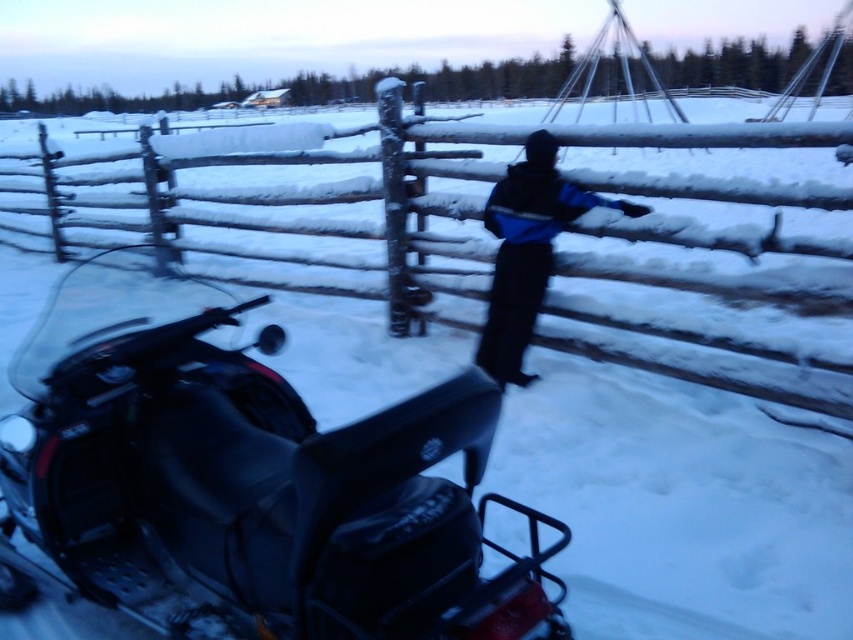
Is snow-covered wooden fence at center in front of dark blue jacket at center?

No, it is behind dark blue jacket at center.

Is point (709, 349) behind point (544, 188)?

Yes.

I want to click on snow-covered wooden fence at center, so (x=347, y=218).

Which is more to the right, matte black snowmobile at lower left or dark blue jacket at center?

From the viewer's perspective, dark blue jacket at center appears more on the right side.

Does point (9, 508) come farther from viewer compared to point (524, 337)?

No, (9, 508) is in front of (524, 337).

This screenshot has width=853, height=640. Find the location of `matte black snowmobile at lower left`. matte black snowmobile at lower left is located at coordinates (248, 483).

Is point (20, 566) farther from camera compared to point (848, 388)?

No.

The image size is (853, 640). What are the coordinates of `matte black snowmobile at lower left` in the screenshot? It's located at (248, 483).